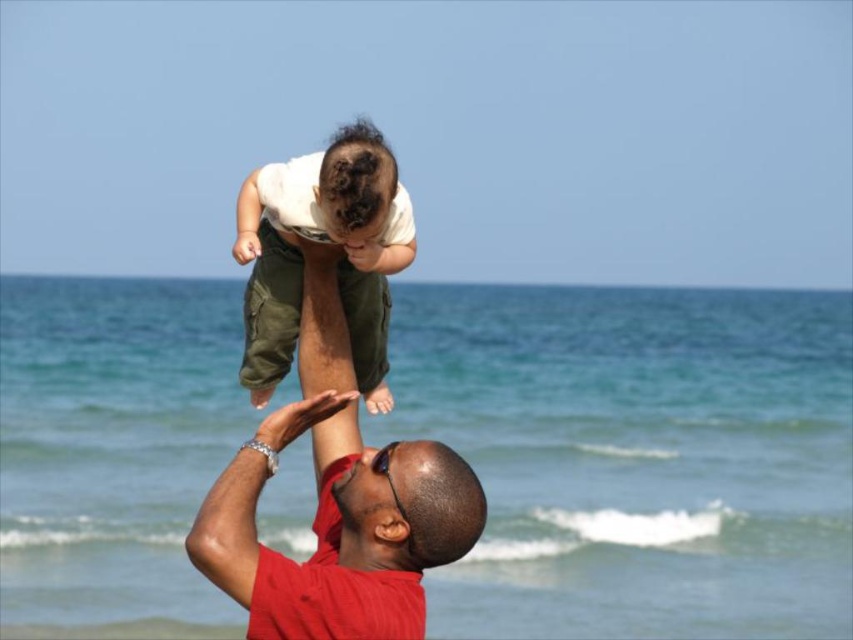
From the picture: You are a photographer trying to capture the perfect shot of the shiny black sunglasses at center. The camera you are using has a focus point at coordinates 0.794, 0.479. Will the sunglasses be in focus?

Yes, the shiny black sunglasses at center is located at point (408, 508), so the focus point matches its location, ensuring the sunglasses will be in focus.

Based on the photo, you are standing at point [405,262] and want to walk to the shore. The shore is 30.12 feet away from your current position. Can you estimate how many steps it would take to reach the shore if each of your steps is about 2.5 feet long?

The distance to the shore is 30.12 feet, and each step is 2.5 feet. Dividing 30.12 by 2.5 gives approximately 12.05 steps. Therefore, you would need about 12 steps to reach the shore.

You are a photographer trying to capture the man and child in the scene. You notice the shiny black sunglasses at center and the dark brown hair at upper center. Which object is positioned lower in the image?

The shiny black sunglasses at center has a lesser height compared to dark brown hair at upper center, so the shiny black sunglasses at center is positioned lower in the image.